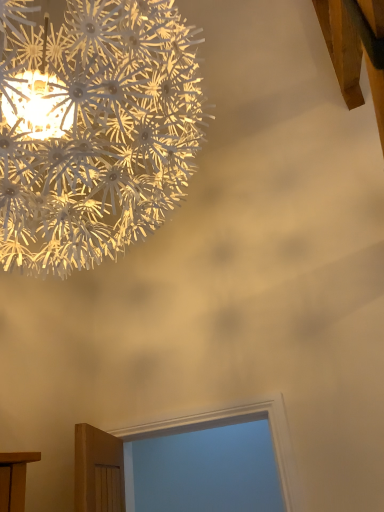
Locate an element on the screen. This screenshot has width=384, height=512. white matte lamp at upper left is located at coordinates (94, 130).

Measure the distance between point (19, 208) and camera.

36.26 inches.

This screenshot has width=384, height=512. What do you see at coordinates (94, 130) in the screenshot?
I see `white matte lamp at upper left` at bounding box center [94, 130].

At what (x,y) coordinates should I click in order to perform the action: click on white matte lamp at upper left. Please return your answer as a coordinate pair (x, y). Image resolution: width=384 pixels, height=512 pixels. Looking at the image, I should click on (94, 130).